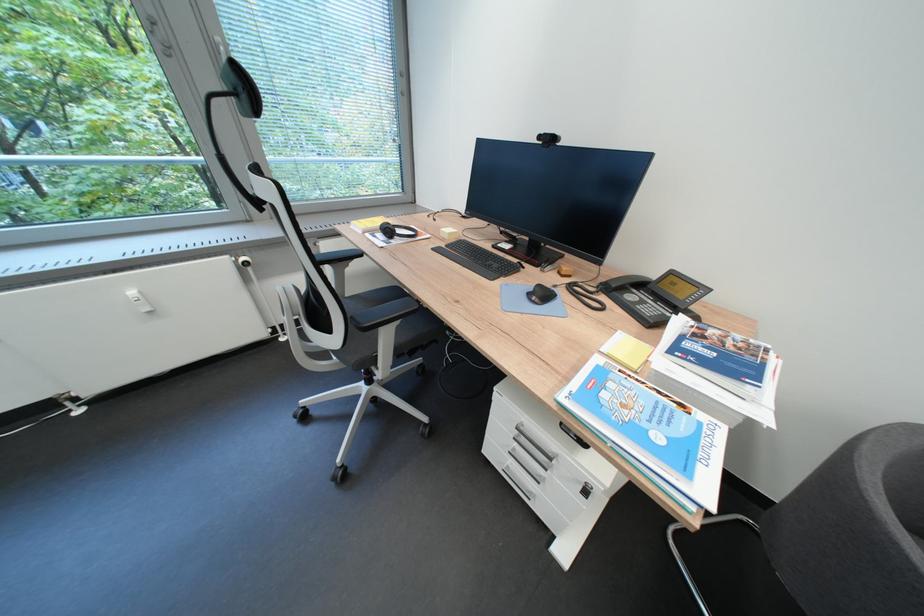
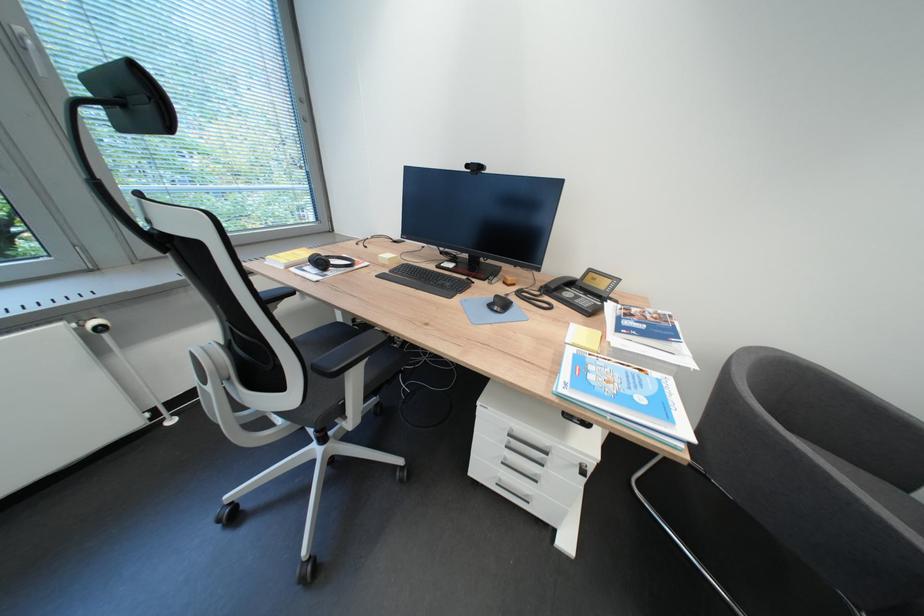
Question: The images are taken continuously from a first-person perspective. In which direction is your viewpoint rotating?

Choices:
 (A) Left
 (B) Right
 (C) Up
 (D) Down

Answer: (B)